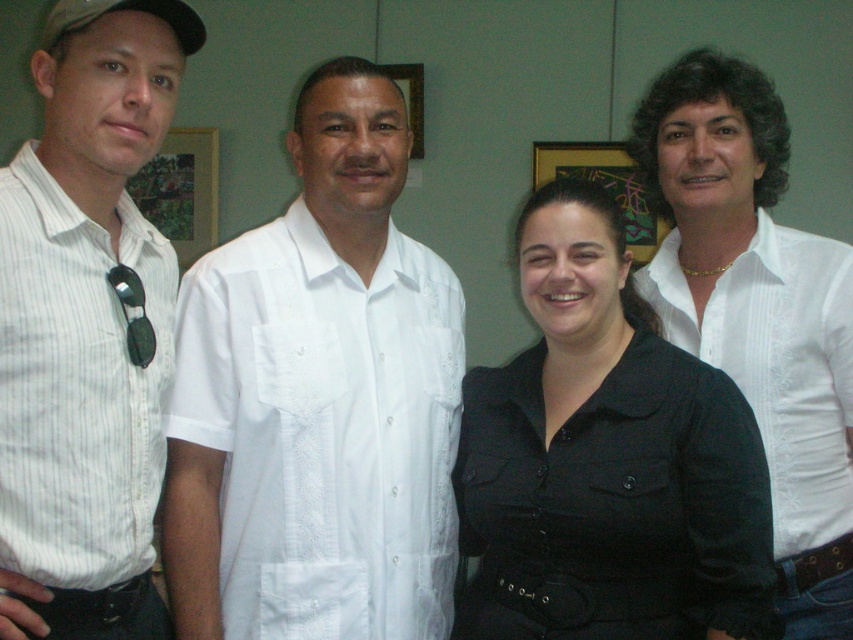
Question: Which point is farther to the camera?

Choices:
 (A) metallic gold picture frame at upper center
 (B) brushed metal picture frame at left
 (C) white embroidered shirt at center

Answer: (B)

Question: Does black matte shirt at center lie behind white textured shirt at upper right?

Choices:
 (A) yes
 (B) no

Answer: (B)

Question: Does white textured shirt at upper right have a smaller size compared to metallic gold picture frame at upper center?

Choices:
 (A) yes
 (B) no

Answer: (B)

Question: Is black matte shirt at center further to camera compared to white textured shirt at upper right?

Choices:
 (A) no
 (B) yes

Answer: (A)

Question: Estimate the real-world distances between objects in this image. Which object is farther from the brushed metal picture frame at left?

Choices:
 (A) white textured shirt at upper right
 (B) white striped shirt at left
 (C) white embroidered shirt at center

Answer: (B)

Question: Which object appears closest to the camera in this image?

Choices:
 (A) white striped shirt at left
 (B) metallic gold picture frame at upper center
 (C) wooden frame at upper center
 (D) white embroidered shirt at center

Answer: (A)